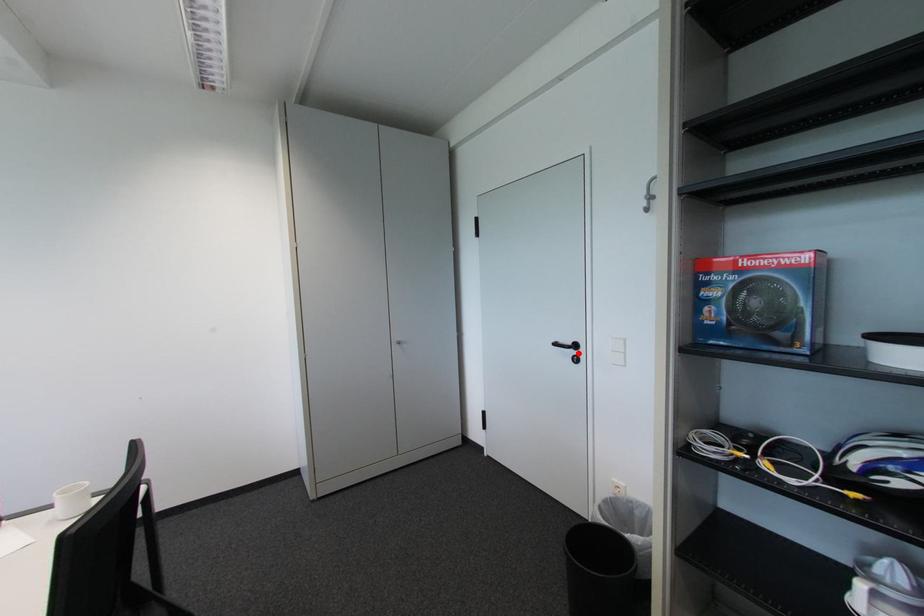
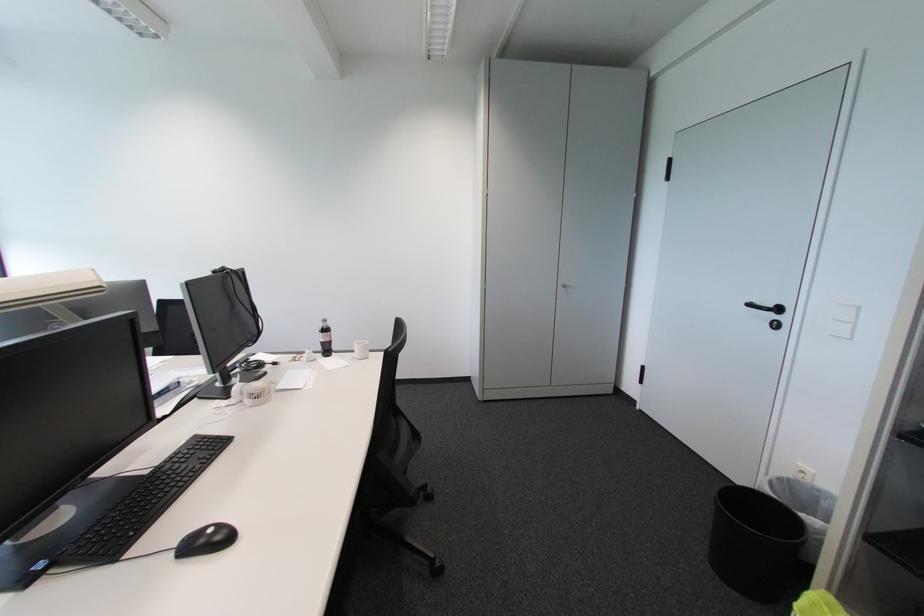
Question: I am providing you with two images of the same scene from different viewpoints. A red point is marked on the first image. At the location where the point appears in image 1, is it still visible in image 2?

Choices:
 (A) Yes
 (B) No

Answer: (A)